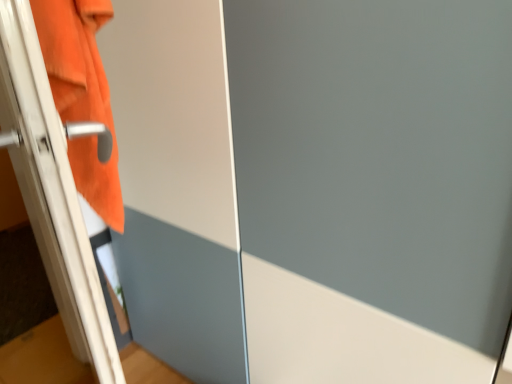
Describe the element at coordinates (82, 94) in the screenshot. I see `orange fabric towel at left` at that location.

Where is `orange fabric towel at left`? This screenshot has height=384, width=512. orange fabric towel at left is located at coordinates (82, 94).

What do you see at coordinates (177, 189) in the screenshot? The height and width of the screenshot is (384, 512). I see `white glossy screen door at left` at bounding box center [177, 189].

I want to click on white glossy screen door at left, so click(177, 189).

What is the approximate width of white glossy screen door at left?

white glossy screen door at left is 7.70 inches in width.

What is the approximate height of white glossy screen door at left?

It is 1.25 meters.

You are a GUI agent. You are given a task and a screenshot of the screen. Output one action in this format:
    pyautogui.click(x=<x>, y=<y>)
    Task: Click on the orange fabric towel at left
    
    Given the screenshot: What is the action you would take?
    pyautogui.click(x=82, y=94)

Considering the positions of objects orange fabric towel at left and white glossy screen door at left in the image provided, who is more to the right, orange fabric towel at left or white glossy screen door at left?

Positioned to the right is orange fabric towel at left.

Is orange fabric towel at left positioned before white glossy screen door at left?

No.

Is point (112, 219) closer to camera compared to point (184, 279)?

Yes, point (112, 219) is closer to viewer.

From the image's perspective, does orange fabric towel at left appear higher than white glossy screen door at left?

Yes, from the image's perspective, orange fabric towel at left is over white glossy screen door at left.

From a real-world perspective, which is physically above, orange fabric towel at left or white glossy screen door at left?

orange fabric towel at left, from a real-world perspective.

Considering the sizes of objects orange fabric towel at left and white glossy screen door at left in the image provided, who is thinner, orange fabric towel at left or white glossy screen door at left?

orange fabric towel at left.

Considering the sizes of objects orange fabric towel at left and white glossy screen door at left in the image provided, who is shorter, orange fabric towel at left or white glossy screen door at left?

orange fabric towel at left is shorter.

Which of these two, orange fabric towel at left or white glossy screen door at left, is bigger?

Bigger between the two is white glossy screen door at left.

Is orange fabric towel at left not inside white glossy screen door at left?

No.

Is orange fabric towel at left not near white glossy screen door at left?

orange fabric towel at left is near white glossy screen door at left, not far away.

Is orange fabric towel at left oriented away from white glossy screen door at left?

Absolutely, orange fabric towel at left is directed away from white glossy screen door at left.

What's the angular difference between orange fabric towel at left and white glossy screen door at left's facing directions?

The angle between the facing direction of orange fabric towel at left and the facing direction of white glossy screen door at left is 175 degrees.

Locate an element on the screen. screen door on the left of orange fabric towel at left is located at coordinates pyautogui.click(x=177, y=189).

Is white glossy screen door at left to the left or to the right of orange fabric towel at left in the image?

Clearly, white glossy screen door at left is on the left of orange fabric towel at left in the image.

Which object is closer to the camera, white glossy screen door at left or orange fabric towel at left?

white glossy screen door at left is closer to the camera.

Is point (176, 71) positioned after point (66, 11)?

Yes, it is.

From the image's perspective, is white glossy screen door at left under orange fabric towel at left?

Yes.

From a real-world perspective, is white glossy screen door at left physically located above or below orange fabric towel at left?

white glossy screen door at left is situated lower than orange fabric towel at left in the real world.

Considering the sizes of objects white glossy screen door at left and orange fabric towel at left in the image provided, who is thinner, white glossy screen door at left or orange fabric towel at left?

With smaller width is orange fabric towel at left.

Is white glossy screen door at left shorter than orange fabric towel at left?

In fact, white glossy screen door at left may be taller than orange fabric towel at left.

In terms of size, does white glossy screen door at left appear bigger or smaller than orange fabric towel at left?

white glossy screen door at left is bigger than orange fabric towel at left.

Is orange fabric towel at left a part of white glossy screen door at left?

Yes, orange fabric towel at left is a part of white glossy screen door at left.

Is white glossy screen door at left next to orange fabric towel at left?

No, white glossy screen door at left is not with orange fabric towel at left.

Is white glossy screen door at left facing away from orange fabric towel at left?

Yes, white glossy screen door at left is facing away from orange fabric towel at left.

Can you tell me how much white glossy screen door at left and orange fabric towel at left differ in facing direction?

They differ by 175 degrees in their facing directions.

How distant is white glossy screen door at left from orange fabric towel at left?

16.45 inches.

This screenshot has height=384, width=512. I want to click on screen door in front of the orange fabric towel at left, so click(x=177, y=189).

Locate an element on the screen. screen door in front of the orange fabric towel at left is located at coordinates (177, 189).

Identify the location of bath towel on the right of white glossy screen door at left. This screenshot has width=512, height=384. (82, 94).